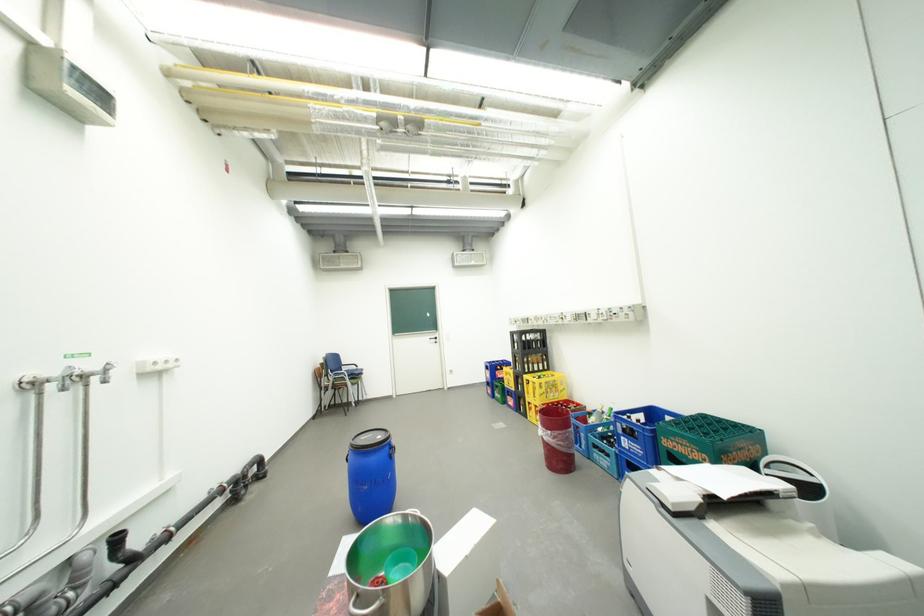
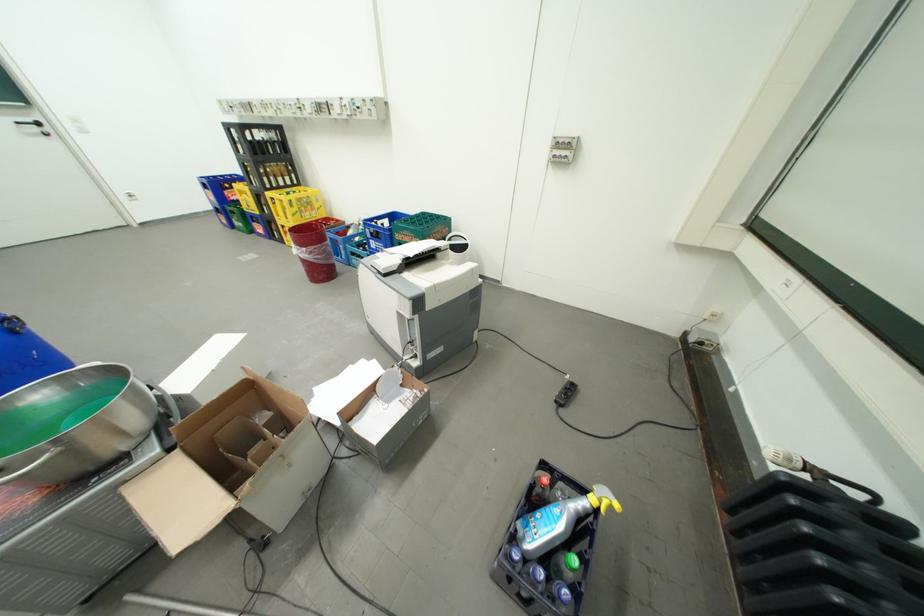
Find the pixel in the second image that matches the point at 560,434 in the first image.

(314, 249)